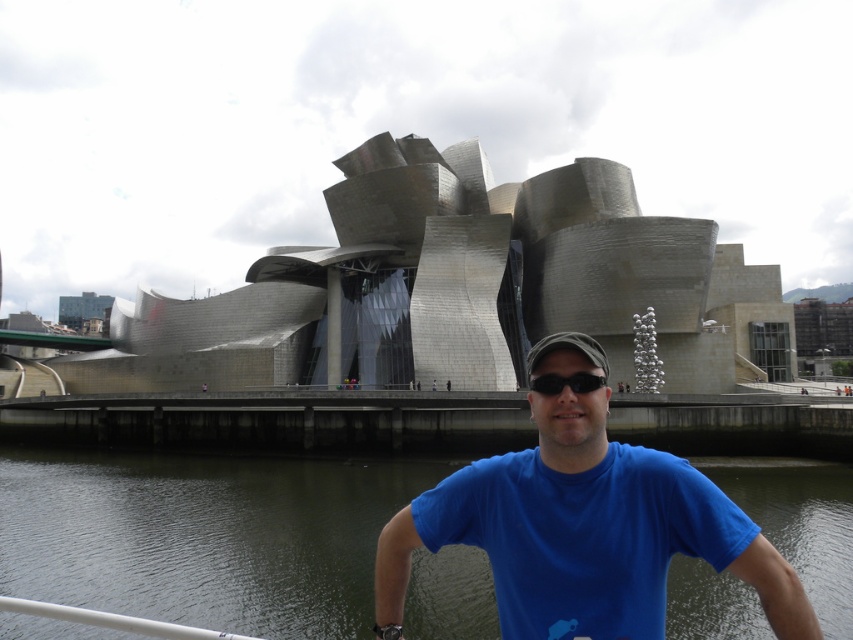
Which of these two, blue cotton shirt at center or black matte sunglasses at center, stands taller?

With more height is blue cotton shirt at center.

Is blue cotton shirt at center to the left of black matte sunglasses at center from the viewer's perspective?

Yes, blue cotton shirt at center is to the left of black matte sunglasses at center.

Locate an element on the screen. blue cotton shirt at center is located at coordinates (583, 525).

Where is `blue cotton shirt at center`? This screenshot has width=853, height=640. blue cotton shirt at center is located at coordinates (583, 525).

Does greenish water at lower center have a greater width compared to black matte sunglasses at center?

Yes, greenish water at lower center is wider than black matte sunglasses at center.

Measure the distance between greenish water at lower center and black matte sunglasses at center.

greenish water at lower center is 41.93 meters away from black matte sunglasses at center.

At what (x,y) coordinates should I click in order to perform the action: click on greenish water at lower center. Please return your answer as a coordinate pair (x, y). This screenshot has width=853, height=640. Looking at the image, I should click on (202, 536).

Is point (422, 600) closer to camera compared to point (721, 497)?

That is False.

This screenshot has height=640, width=853. In order to click on greenish water at lower center in this screenshot , I will do `click(202, 536)`.

Locate an element on the screen. The height and width of the screenshot is (640, 853). greenish water at lower center is located at coordinates (202, 536).